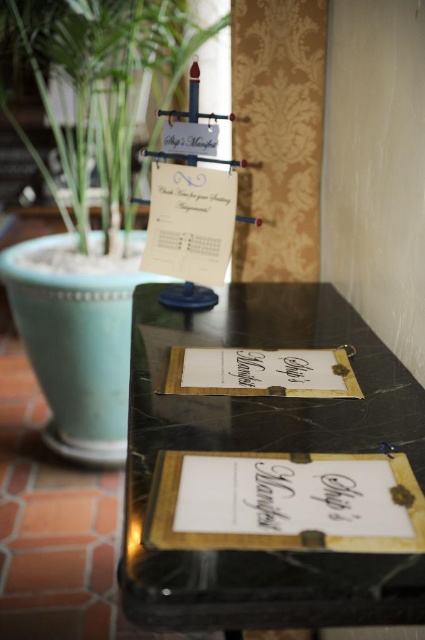
Question: Can you confirm if gold textured clipboard at center is wider than gold paper at center?

Choices:
 (A) yes
 (B) no

Answer: (A)

Question: Which of these objects is positioned closest to the green leafy plant at upper left?

Choices:
 (A) black marble table at center
 (B) gold textured clipboard at center
 (C) gold textured paper at center

Answer: (A)

Question: Does gold textured paper at center have a larger size compared to gold paper at center?

Choices:
 (A) yes
 (B) no

Answer: (B)

Question: Which point is closer to the camera?

Choices:
 (A) (306, 356)
 (B) (241, 499)

Answer: (B)

Question: Does gold textured paper at center have a greater width compared to gold paper at center?

Choices:
 (A) yes
 (B) no

Answer: (B)

Question: Which of the following is the closest to the observer?

Choices:
 (A) gold textured clipboard at center
 (B) gold textured paper at center
 (C) black marble table at center

Answer: (C)